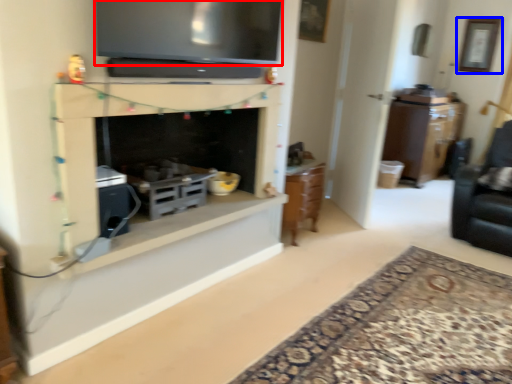
Question: Which object appears farthest to the camera in this image, television (highlighted by a red box) or picture frame (highlighted by a blue box)?

Choices:
 (A) television
 (B) picture frame

Answer: (B)